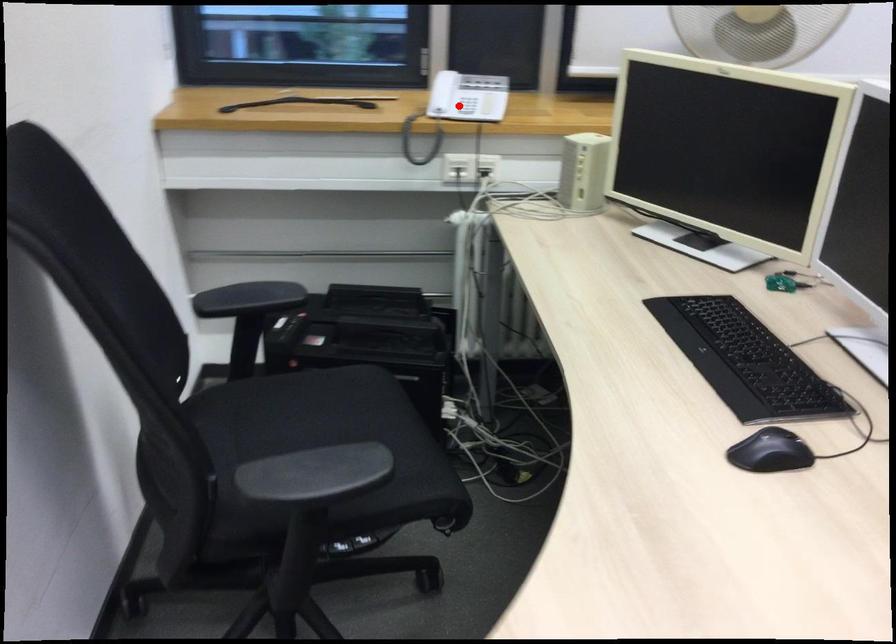
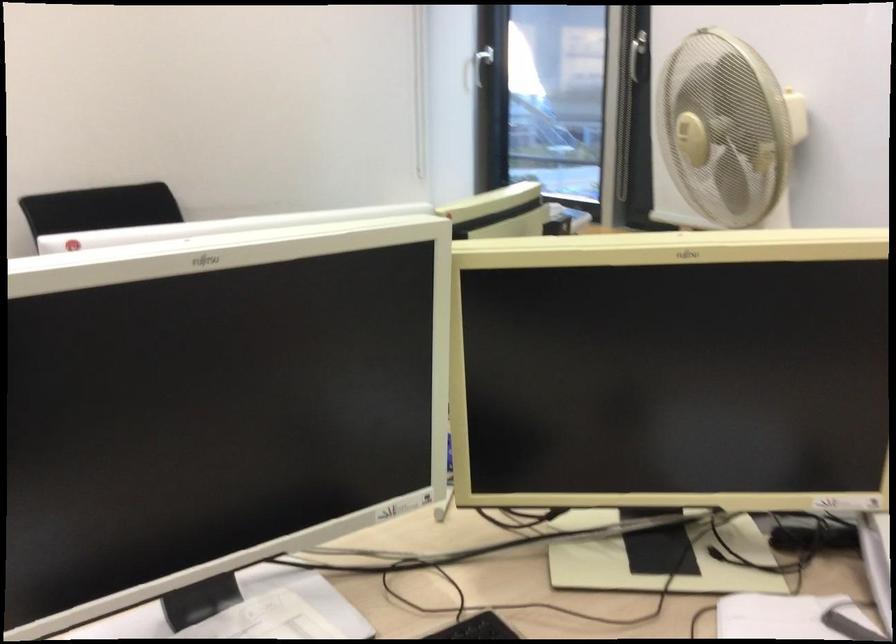
Question: I am providing you with two images of the same scene from different viewpoints. A red point is marked on the first image. Can you still see the location of the red point in image 2?

Choices:
 (A) Yes
 (B) No

Answer: (B)